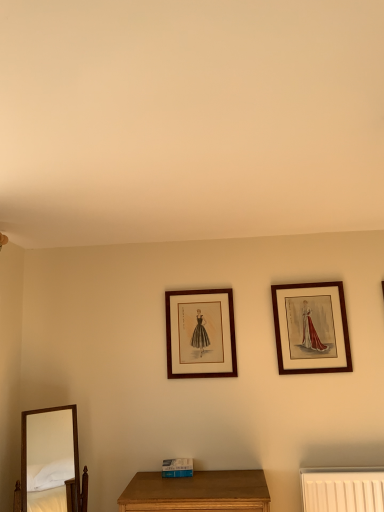
The height and width of the screenshot is (512, 384). Describe the element at coordinates (311, 328) in the screenshot. I see `wooden framed print at upper right, arranged as the 1th picture frame when viewed from the right` at that location.

How much space does matte wood picture frame at center, marked as the first picture frame in a left-to-right arrangement, occupy horizontally?

It is 4.50 centimeters.

Describe the element at coordinates (200, 334) in the screenshot. I see `matte wood picture frame at center, acting as the second picture frame starting from the right` at that location.

Where is `wooden framed print at upper right, arranged as the 1th picture frame when viewed from the right`? The height and width of the screenshot is (512, 384). wooden framed print at upper right, arranged as the 1th picture frame when viewed from the right is located at coordinates (311, 328).

Can we say matte wood picture frame at center, acting as the second picture frame starting from the right, lies outside wooden framed print at upper right, the 2th picture frame viewed from the left?

Indeed, matte wood picture frame at center, acting as the second picture frame starting from the right, is completely outside wooden framed print at upper right, the 2th picture frame viewed from the left.

Are matte wood picture frame at center, marked as the first picture frame in a left-to-right arrangement, and wooden framed print at upper right, arranged as the 1th picture frame when viewed from the right, beside each other?

No, matte wood picture frame at center, marked as the first picture frame in a left-to-right arrangement, is not in contact with wooden framed print at upper right, arranged as the 1th picture frame when viewed from the right.

Is point (213, 341) positioned in front of point (303, 358)?

No, (213, 341) is behind (303, 358).

From the picture: From a real-world perspective, does wooden mirror at lower left stand above wooden framed print at upper right, the 2th picture frame viewed from the left?

No.

What's the angular difference between wooden mirror at lower left and wooden framed print at upper right, arranged as the 1th picture frame when viewed from the right,'s facing directions?

The angular difference between wooden mirror at lower left and wooden framed print at upper right, arranged as the 1th picture frame when viewed from the right, is 39.8 degrees.

Is wooden mirror at lower left taller than wooden framed print at upper right, the 2th picture frame viewed from the left?

Indeed, wooden mirror at lower left has a greater height compared to wooden framed print at upper right, the 2th picture frame viewed from the left.

In terms of width, does wooden mirror at lower left look wider or thinner when compared to wooden framed print at upper right, the 2th picture frame viewed from the left?

Considering their sizes, wooden mirror at lower left looks broader than wooden framed print at upper right, the 2th picture frame viewed from the left.

Is wooden framed print at upper right, the 2th picture frame viewed from the left, closer to camera compared to matte wood picture frame at center, acting as the second picture frame starting from the right?

That is True.

Based on the photo, is wooden framed print at upper right, arranged as the 1th picture frame when viewed from the right, completely or partially outside of matte wood picture frame at center, marked as the first picture frame in a left-to-right arrangement?

wooden framed print at upper right, arranged as the 1th picture frame when viewed from the right, is positioned outside matte wood picture frame at center, marked as the first picture frame in a left-to-right arrangement.

Which of these two, wooden framed print at upper right, the 2th picture frame viewed from the left, or matte wood picture frame at center, marked as the first picture frame in a left-to-right arrangement, is wider?

wooden framed print at upper right, the 2th picture frame viewed from the left, is wider.

Who is bigger, matte wood picture frame at center, acting as the second picture frame starting from the right, or wooden mirror at lower left?

With larger size is wooden mirror at lower left.

Is matte wood picture frame at center, acting as the second picture frame starting from the right, touching wooden mirror at lower left?

No, matte wood picture frame at center, acting as the second picture frame starting from the right, is not next to wooden mirror at lower left.

Looking at this image, considering the sizes of matte wood picture frame at center, acting as the second picture frame starting from the right, and wooden mirror at lower left in the image, is matte wood picture frame at center, acting as the second picture frame starting from the right, wider or thinner than wooden mirror at lower left?

Clearly, matte wood picture frame at center, acting as the second picture frame starting from the right, has less width compared to wooden mirror at lower left.

From a real-world perspective, is wooden mirror at lower left physically located above or below matte wood picture frame at center, marked as the first picture frame in a left-to-right arrangement?

wooden mirror at lower left is situated lower than matte wood picture frame at center, marked as the first picture frame in a left-to-right arrangement, in the real world.

Does wooden mirror at lower left have a lesser height compared to matte wood picture frame at center, marked as the first picture frame in a left-to-right arrangement?

Incorrect, the height of wooden mirror at lower left does not fall short of that of matte wood picture frame at center, marked as the first picture frame in a left-to-right arrangement.

Between wooden mirror at lower left and matte wood picture frame at center, acting as the second picture frame starting from the right, which one has smaller width?

With smaller width is matte wood picture frame at center, acting as the second picture frame starting from the right.

Is wooden mirror at lower left positioned behind matte wood picture frame at center, marked as the first picture frame in a left-to-right arrangement?

That is False.

From the image's perspective, relative to wooden mirror at lower left, is wooden framed print at upper right, arranged as the 1th picture frame when viewed from the right, above or below?

Clearly, from the image's perspective, wooden framed print at upper right, arranged as the 1th picture frame when viewed from the right, is above wooden mirror at lower left.

This screenshot has height=512, width=384. Find the location of `mirror on the left of wooden framed print at upper right, the 2th picture frame viewed from the left`. mirror on the left of wooden framed print at upper right, the 2th picture frame viewed from the left is located at coordinates [49, 454].

Considering the positions of point (336, 298) and point (66, 441), is point (336, 298) closer or farther from the camera than point (66, 441)?

Point (336, 298) is farther from the camera than point (66, 441).

Looking at this image, based on their sizes in the image, would you say wooden framed print at upper right, arranged as the 1th picture frame when viewed from the right, is bigger or smaller than wooden mirror at lower left?

Considering their sizes, wooden framed print at upper right, arranged as the 1th picture frame when viewed from the right, takes up less space than wooden mirror at lower left.

The height and width of the screenshot is (512, 384). Identify the location of picture frame to the right of matte wood picture frame at center, acting as the second picture frame starting from the right. (311, 328).

The width and height of the screenshot is (384, 512). Find the location of `mirror on the left side of wooden framed print at upper right, arranged as the 1th picture frame when viewed from the right`. mirror on the left side of wooden framed print at upper right, arranged as the 1th picture frame when viewed from the right is located at coordinates (49, 454).

Considering their positions, is matte wood picture frame at center, marked as the first picture frame in a left-to-right arrangement, positioned further to wooden mirror at lower left than wooden framed print at upper right, arranged as the 1th picture frame when viewed from the right?

wooden framed print at upper right, arranged as the 1th picture frame when viewed from the right, is further to wooden mirror at lower left.

From the picture: Looking at the image, which one is located closer to wooden framed print at upper right, the 2th picture frame viewed from the left, wooden mirror at lower left or matte wood picture frame at center, acting as the second picture frame starting from the right?

Among the two, matte wood picture frame at center, acting as the second picture frame starting from the right, is located nearer to wooden framed print at upper right, the 2th picture frame viewed from the left.

Looking at the image, which one is located closer to matte wood picture frame at center, marked as the first picture frame in a left-to-right arrangement, wooden mirror at lower left or wooden framed print at upper right, the 2th picture frame viewed from the left?

wooden framed print at upper right, the 2th picture frame viewed from the left, is positioned closer to the anchor matte wood picture frame at center, marked as the first picture frame in a left-to-right arrangement.

From the picture: Estimate the real-world distances between objects in this image. Which object is closer to wooden mirror at lower left, wooden framed print at upper right, arranged as the 1th picture frame when viewed from the right, or matte wood picture frame at center, acting as the second picture frame starting from the right?

matte wood picture frame at center, acting as the second picture frame starting from the right, is positioned closer to the anchor wooden mirror at lower left.

Based on their spatial positions, is wooden framed print at upper right, arranged as the 1th picture frame when viewed from the right, or wooden mirror at lower left closer to matte wood picture frame at center, acting as the second picture frame starting from the right?

The object closer to matte wood picture frame at center, acting as the second picture frame starting from the right, is wooden framed print at upper right, arranged as the 1th picture frame when viewed from the right.

Which object lies further to the anchor point wooden framed print at upper right, the 2th picture frame viewed from the left, matte wood picture frame at center, acting as the second picture frame starting from the right, or wooden mirror at lower left?

wooden mirror at lower left lies further to wooden framed print at upper right, the 2th picture frame viewed from the left, than the other object.

At what (x,y) coordinates should I click in order to perform the action: click on picture frame located between wooden mirror at lower left and wooden framed print at upper right, arranged as the 1th picture frame when viewed from the right, in the left-right direction. Please return your answer as a coordinate pair (x, y). The width and height of the screenshot is (384, 512). Looking at the image, I should click on (200, 334).